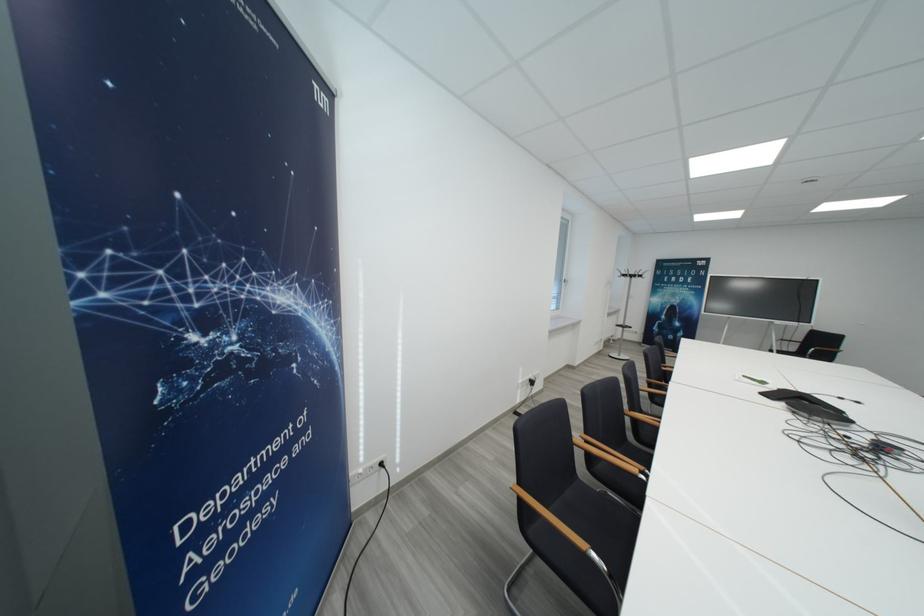
This screenshot has height=616, width=924. Identify the location of coat rack hook. (631, 273).